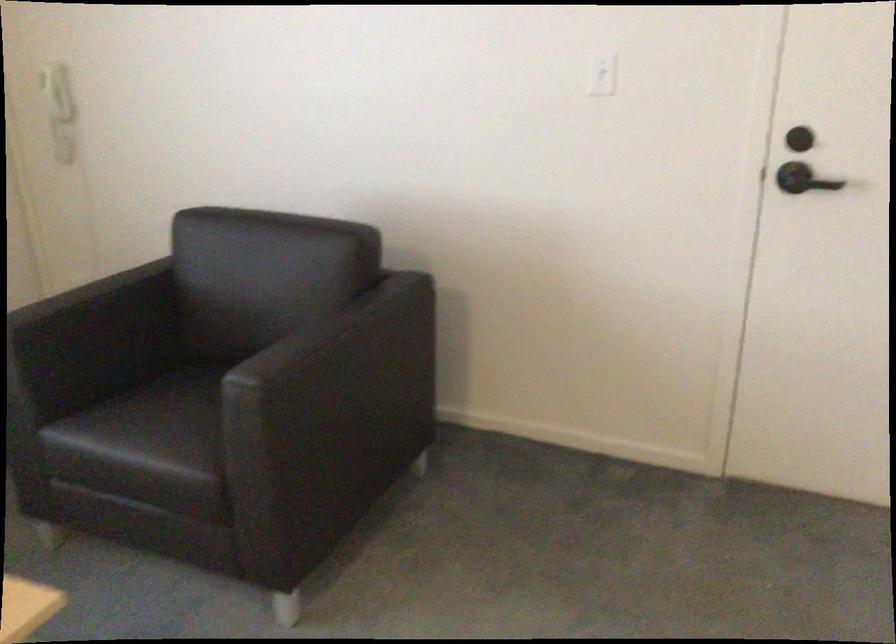
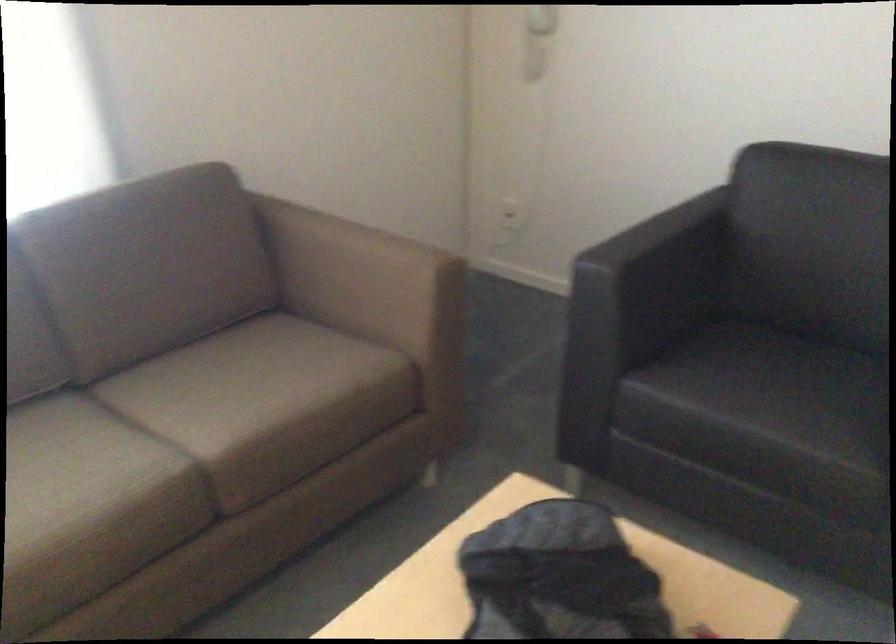
Question: How did the camera likely rotate?

Choices:
 (A) Left
 (B) Right
 (C) Up
 (D) Down

Answer: (A)